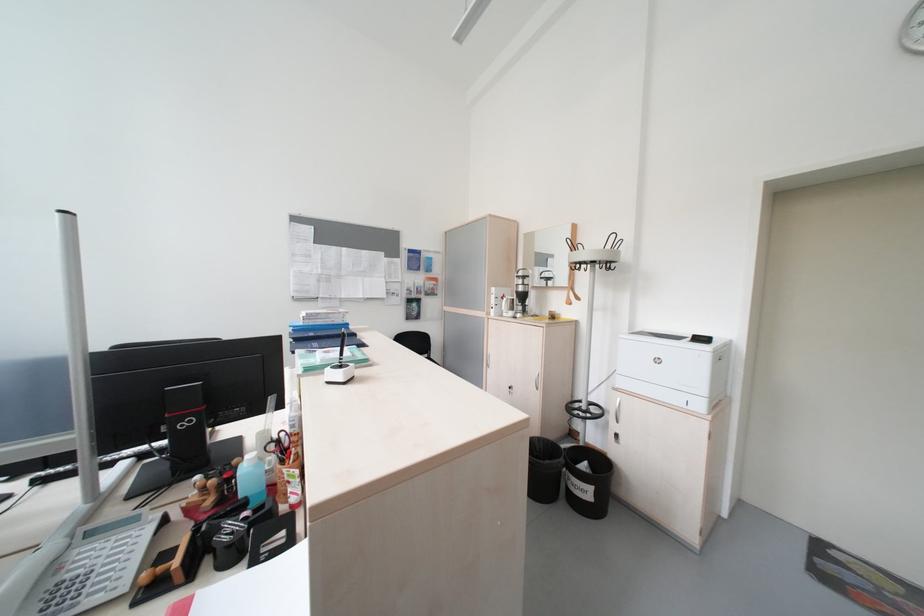
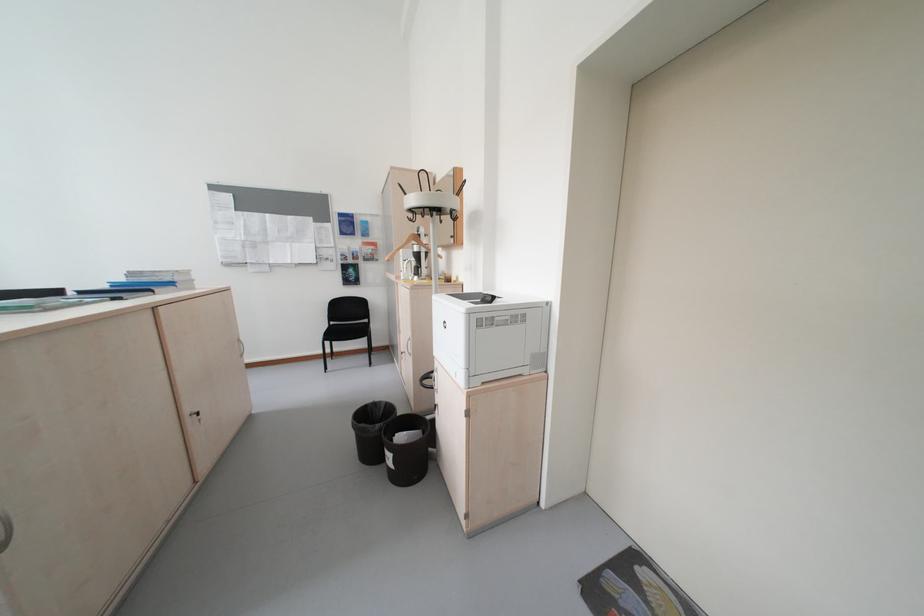
Question: In a continuous first-person perspective shot, in which direction is the camera moving?

Choices:
 (A) Left
 (B) Right
 (C) Forward
 (D) Backward

Answer: (B)